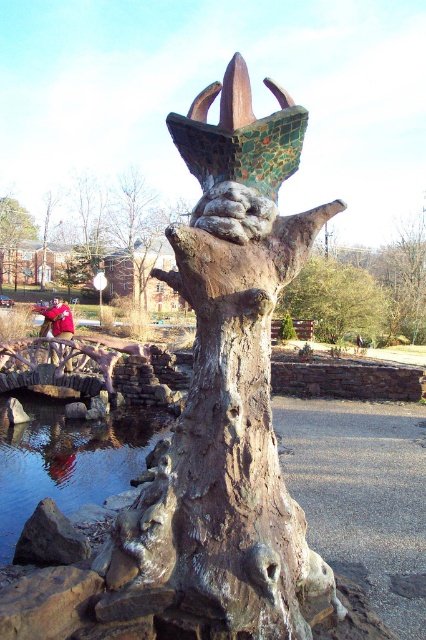
You are standing in the park and see the green mosaic tree at upper center and the green matte tree at lower left. Which one is more to the right?

The green mosaic tree at upper center is more to the right than the green matte tree at lower left.

You are standing at the point marked as point [336,300] in the image. What object are you currently standing on?

You are standing on the green mosaic tree at upper center.

You are an artist planning to install a new sculpture in the park. You have a sculpture that is 12 meters long. The sculpture needs to be placed between the green mosaic tree at upper center and the matte red head at center. Is there enough space between them to fit your sculpture?

The distance between the green mosaic tree at upper center and the matte red head at center is 10.98 meters. Since your sculpture is 12 meters long, it is longer than the available space. Therefore, there is not enough space to fit the sculpture between them.